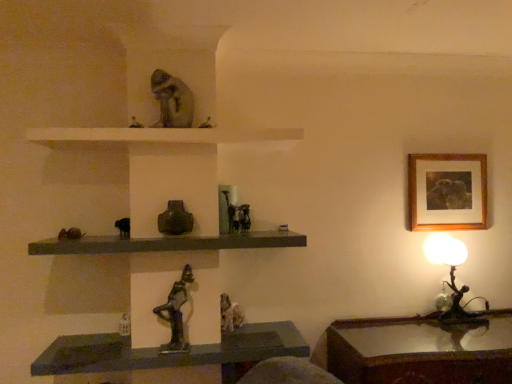
Locate an element on the screen. The width and height of the screenshot is (512, 384). free space in front of rustic stone figurine at center, which is the 4th animal in top-to-bottom order is located at coordinates (233, 338).